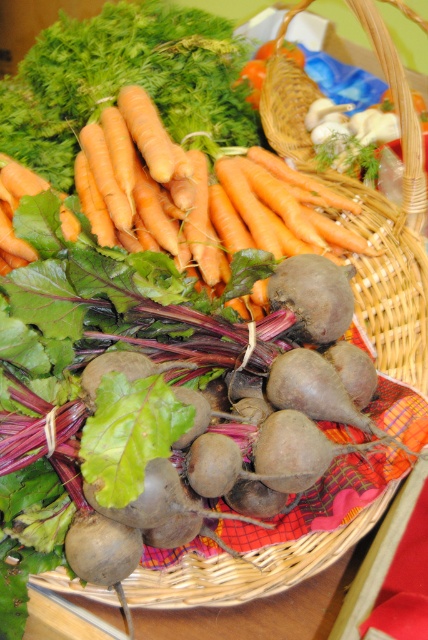
From the picture: Which is more to the left, orange smooth carrot at upper center or woven wicker basket at center?

From the viewer's perspective, orange smooth carrot at upper center appears more on the left side.

I want to click on orange smooth carrot at upper center, so [x=198, y=195].

Between point (243, 292) and point (427, 259), which one is positioned behind?

Positioned behind is point (427, 259).

Where is `orange smooth carrot at upper center`? This screenshot has height=640, width=428. orange smooth carrot at upper center is located at coordinates (198, 195).